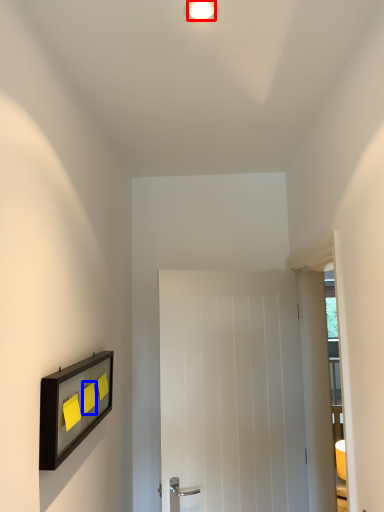
Question: Which of the following is the farthest to the observer, light fixture (highlighted by a red box) or light switch (highlighted by a blue box)?

Choices:
 (A) light fixture
 (B) light switch

Answer: (B)